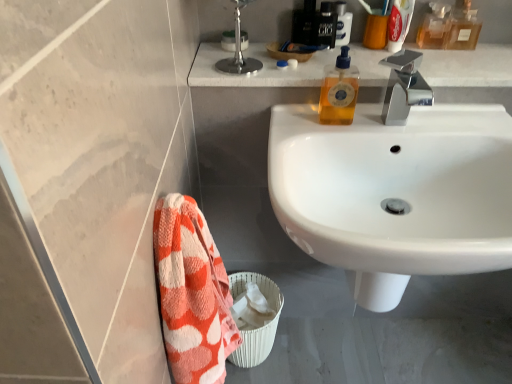
Find the location of a particular element. The image size is (512, 384). empty space that is ontop of white marble countertop at upper center (from a real-world perspective) is located at coordinates (368, 57).